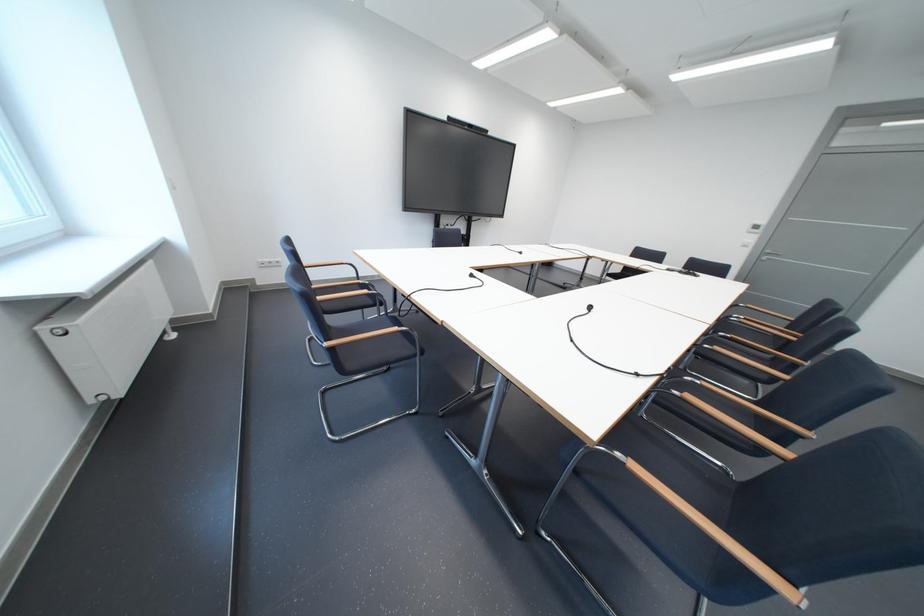
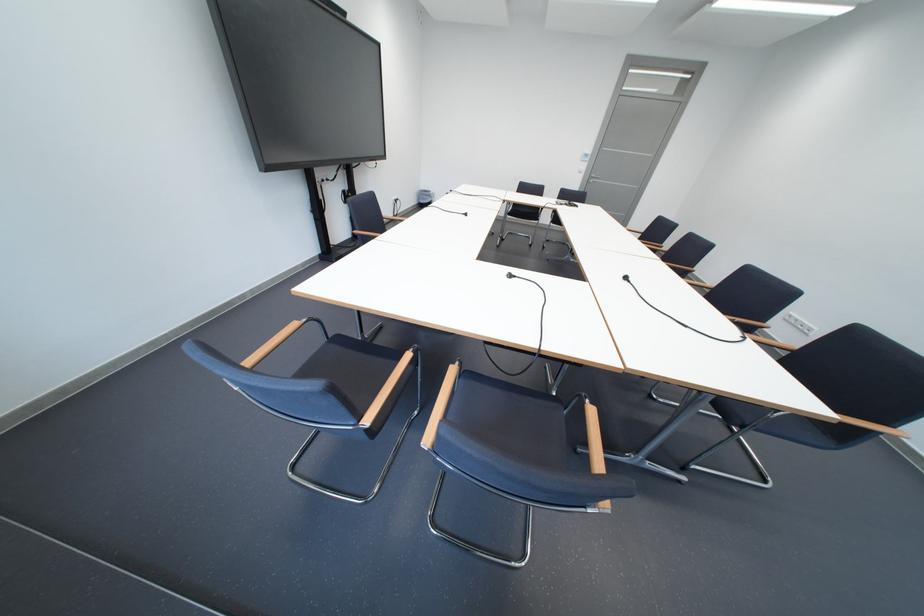
The point at (763, 241) is marked in the first image. Where is the corresponding point in the second image?

(596, 168)